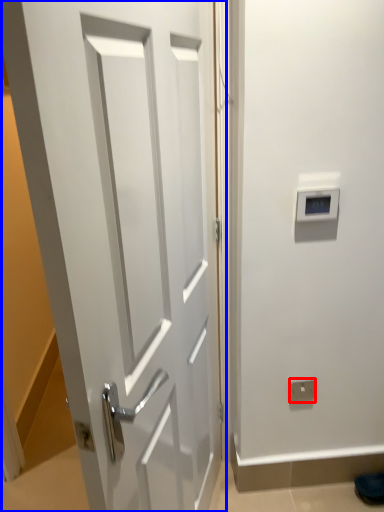
Question: Which object appears closest to the camera in this image, electric outlet (highlighted by a red box) or door (highlighted by a blue box)?

Choices:
 (A) electric outlet
 (B) door

Answer: (B)